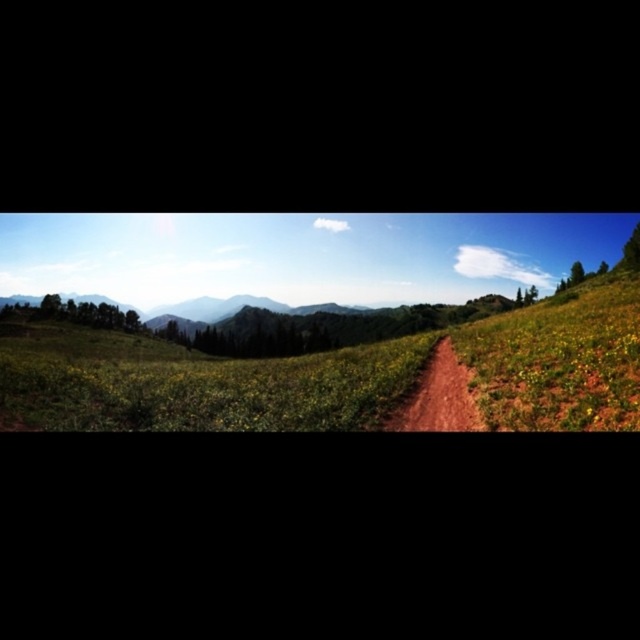
Question: Is green grassy field at center below brown dirt track at center?

Choices:
 (A) no
 (B) yes

Answer: (B)

Question: Among these objects, which one is nearest to the camera?

Choices:
 (A) brown dirt track at center
 (B) green grassy field at center

Answer: (B)

Question: Among these objects, which one is farthest from the camera?

Choices:
 (A) brown dirt track at center
 (B) green grassy field at center

Answer: (A)

Question: Does green grassy field at center have a smaller size compared to brown dirt track at center?

Choices:
 (A) yes
 (B) no

Answer: (B)

Question: Is green grassy field at center wider than brown dirt track at center?

Choices:
 (A) no
 (B) yes

Answer: (B)